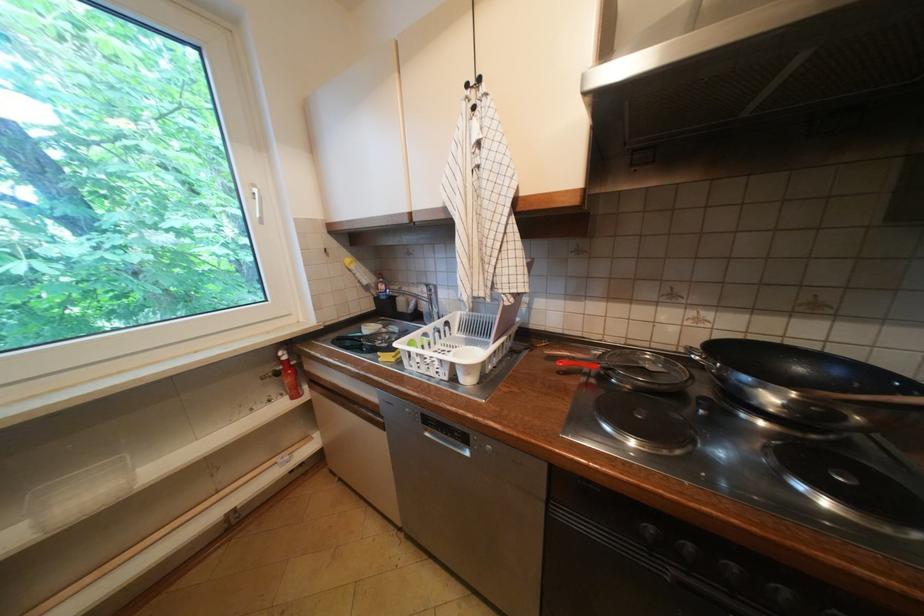
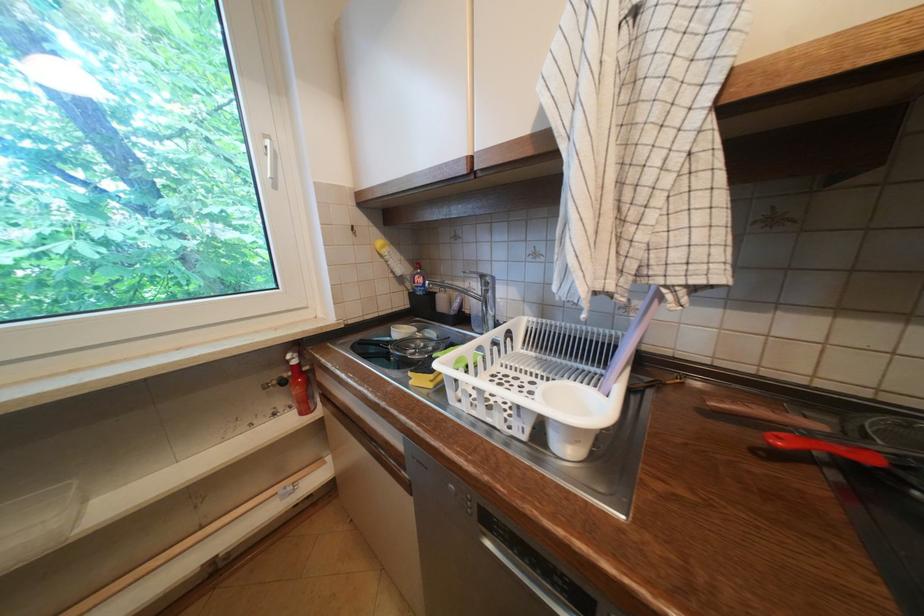
Where in the second image is the point corresponding to point (287, 359) from the first image?

(296, 362)